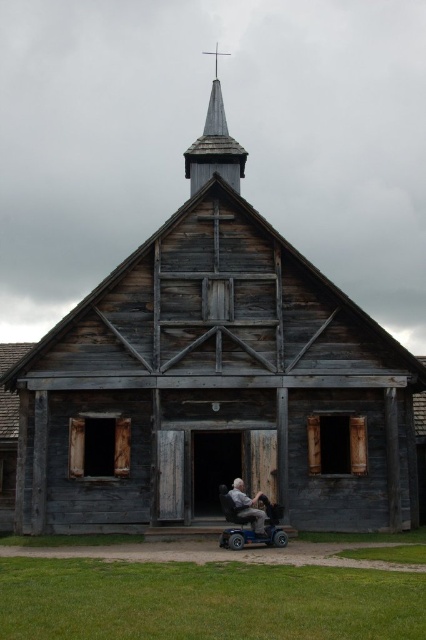
Question: Does wooden spire at upper center appear over gray plastic wheelchair at center?

Choices:
 (A) yes
 (B) no

Answer: (A)

Question: Does metallic gray scooter at center have a lesser width compared to gray plastic wheelchair at center?

Choices:
 (A) no
 (B) yes

Answer: (A)

Question: Which point appears farthest from the camera in this image?

Choices:
 (A) (245, 516)
 (B) (192, 186)
 (C) (238, 488)

Answer: (B)

Question: Among these objects, which one is farthest from the camera?

Choices:
 (A) metallic gray scooter at center
 (B) wooden spire at upper center
 (C) gray plastic wheelchair at center

Answer: (B)

Question: From the image, what is the correct spatial relationship of metallic gray scooter at center in relation to gray plastic wheelchair at center?

Choices:
 (A) below
 (B) above

Answer: (A)

Question: Which of the following is the closest to the observer?

Choices:
 (A) (253, 532)
 (B) (242, 506)

Answer: (A)